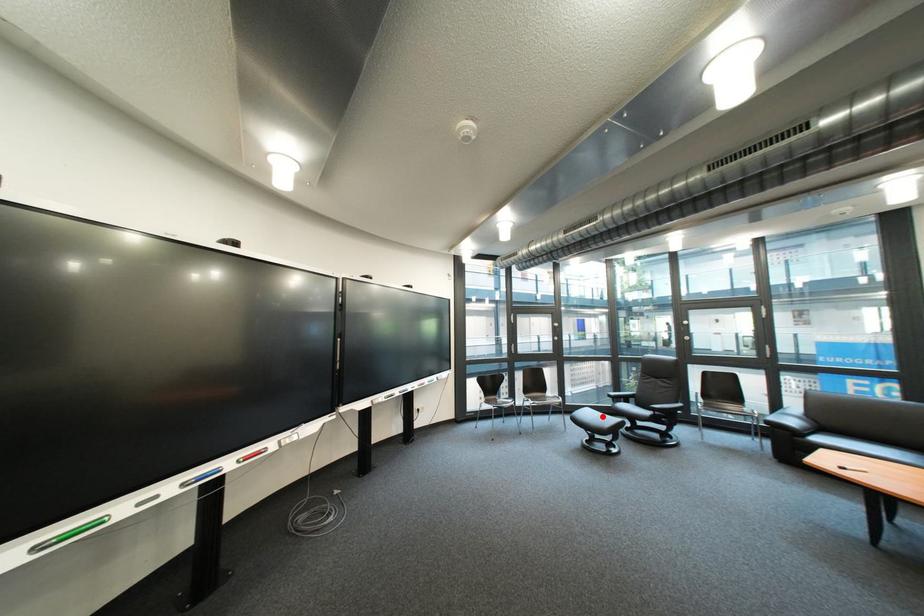
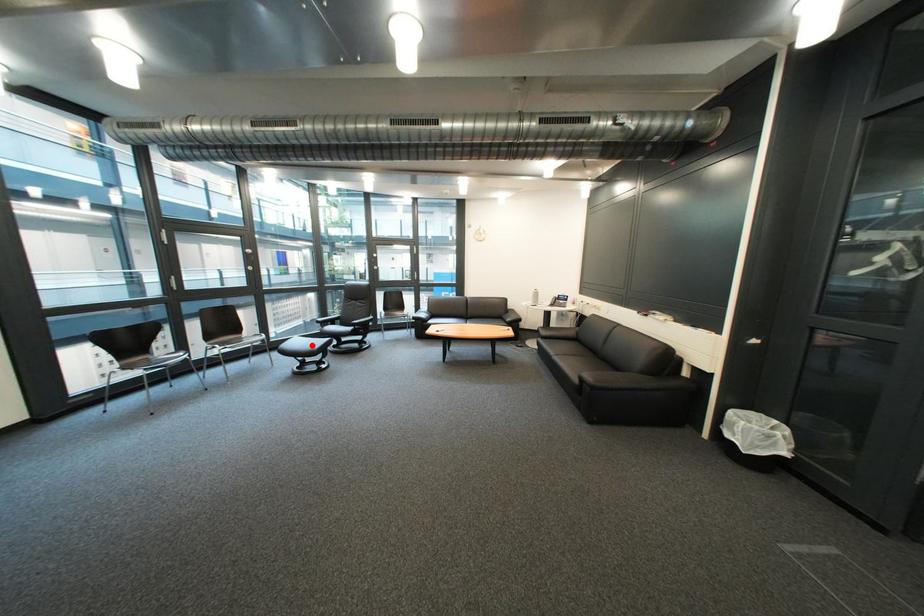
I am providing you with two images of the same scene from different viewpoints. A red point is marked on the first image and another point is marked on the second image. Are the points marked in image1 and image2 representing the same 3D position?

Yes